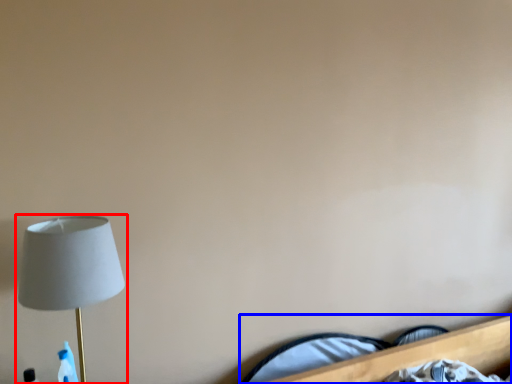
Question: Which of the following is the closest to the observer, lamp (highlighted by a red box) or bed (highlighted by a blue box)?

Choices:
 (A) lamp
 (B) bed

Answer: (A)